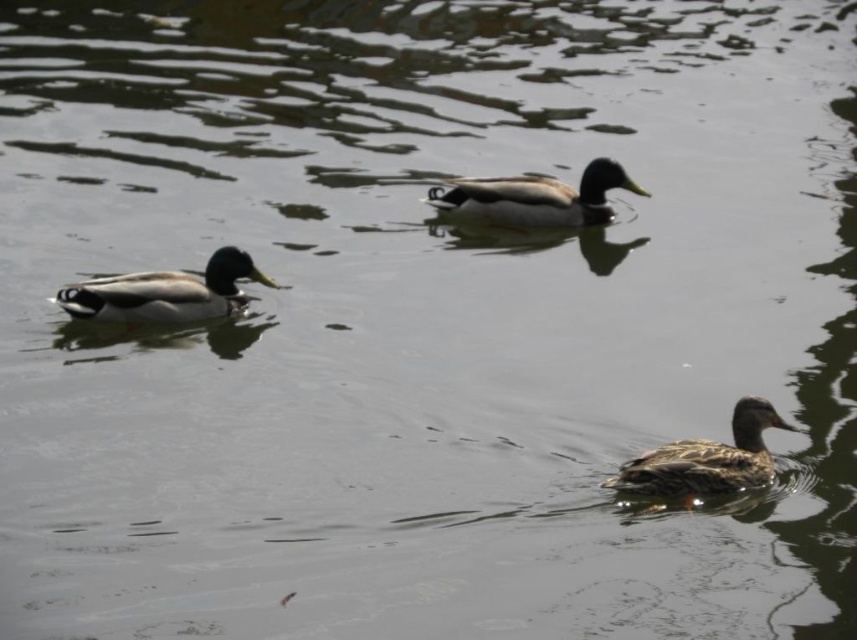
Is point (738, 452) farther from viewer compared to point (532, 193)?

No, (738, 452) is closer to viewer.

Is brown speckled duck at lower right positioned in front of green glossy duck at center?

Yes, brown speckled duck at lower right is closer to the viewer.

The image size is (857, 640). What do you see at coordinates (706, 460) in the screenshot?
I see `brown speckled duck at lower right` at bounding box center [706, 460].

At what (x,y) coordinates should I click in order to perform the action: click on brown speckled duck at lower right. Please return your answer as a coordinate pair (x, y). The width and height of the screenshot is (857, 640). Looking at the image, I should click on (706, 460).

Is point (153, 310) positioned before point (574, 208)?

Yes, it is in front of point (574, 208).

Between green glossy duck at left and green glossy duck at center, which one appears on the left side from the viewer's perspective?

Positioned to the left is green glossy duck at left.

Is point (231, 259) positioned behind point (531, 186)?

That is False.

This screenshot has width=857, height=640. In order to click on green glossy duck at left in this screenshot , I will do `click(165, 292)`.

Is point (660, 460) behind point (186, 320)?

No, (660, 460) is in front of (186, 320).

The width and height of the screenshot is (857, 640). Describe the element at coordinates (706, 460) in the screenshot. I see `brown speckled duck at lower right` at that location.

Find the location of a particular element. This screenshot has width=857, height=640. brown speckled duck at lower right is located at coordinates (706, 460).